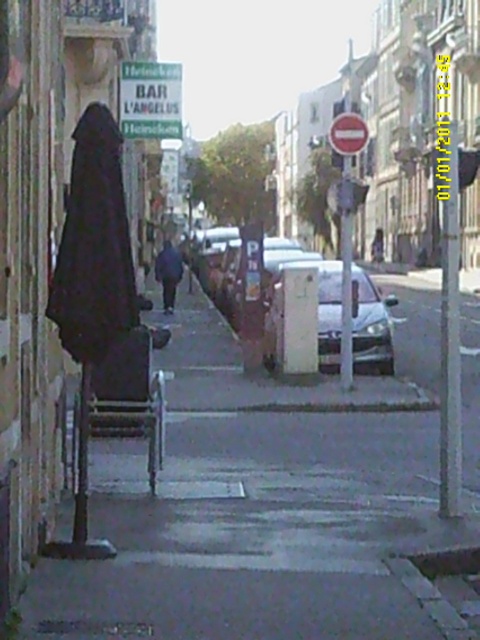
You are a delivery person who needs to place a small package on the ground near the black matte coat at left. Based on the coordinates provided, where should you place the package?

You should place the package near the black matte coat at left at point (94,244).

You are standing at the point labeled as point (265, 512). Which object is directly to your right? Please choose between the BAR L ANGELUS building and the dark gray concrete sidewalk at left.

The dark gray concrete sidewalk at left is directly to the right of point (265, 512), as the point indicates its location.

You are a delivery person who needs to place a large package on the sidewalk. You see the dark gray concrete sidewalk at left and the dark gray coat at center. Which surface can you use to place the package without obstructing the coat?

The dark gray concrete sidewalk at left is in front of the dark gray coat at center, so you can place the package on the dark gray concrete sidewalk at left without obstructing the coat.